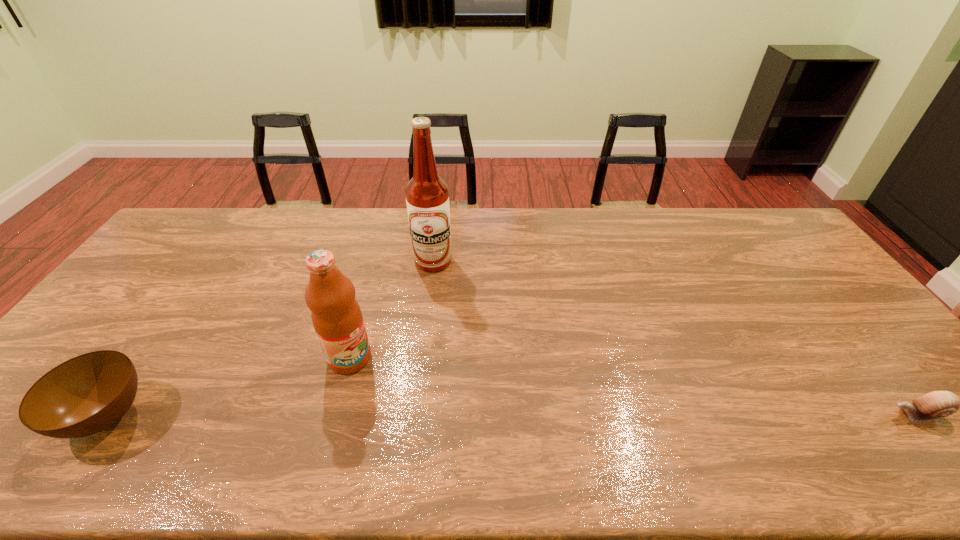
You are a GUI agent. You are given a task and a screenshot of the screen. Output one action in this format:
    pyautogui.click(x=<x>, y=<y>)
    Task: Click on the vacant space that satisfies the following two spatial constraints: 1. on the back side of the escargot; 2. on the front-facing side of the second shortest object
    This screenshot has width=960, height=540.
    Given the screenshot: What is the action you would take?
    pyautogui.click(x=108, y=414)